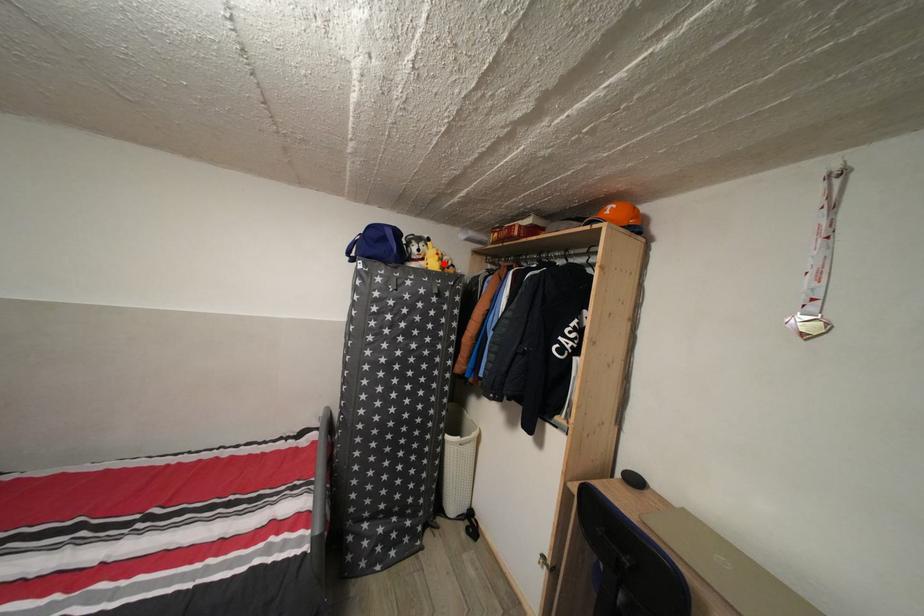
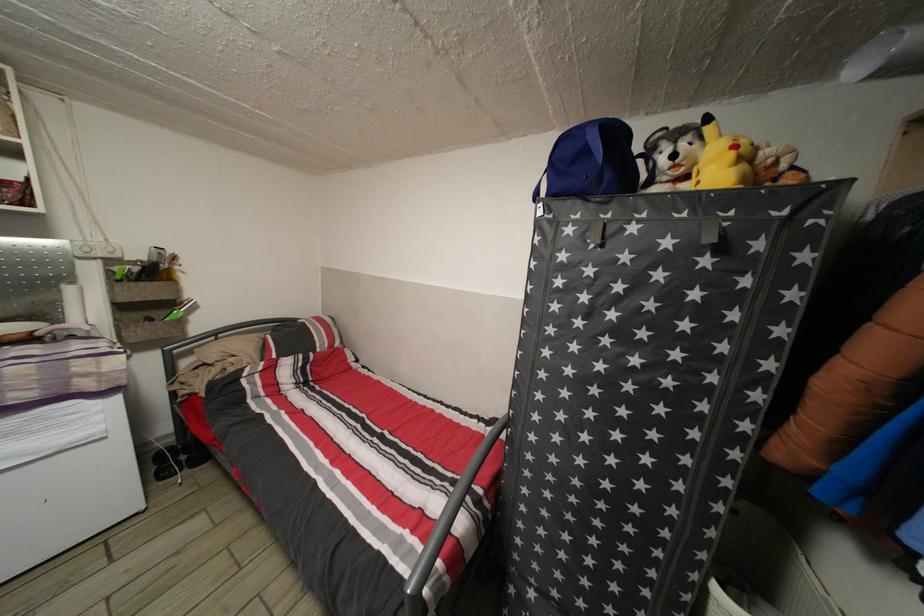
The point at the highlighted location is marked in the first image. Where is the corresponding point in the second image?

(738, 161)